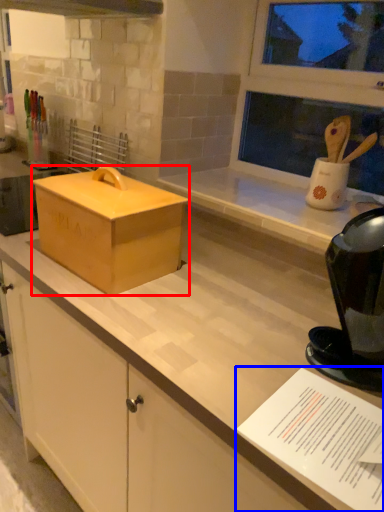
Question: Which object is closer to the camera taking this photo, box (highlighted by a red box) or paper (highlighted by a blue box)?

Choices:
 (A) box
 (B) paper

Answer: (B)